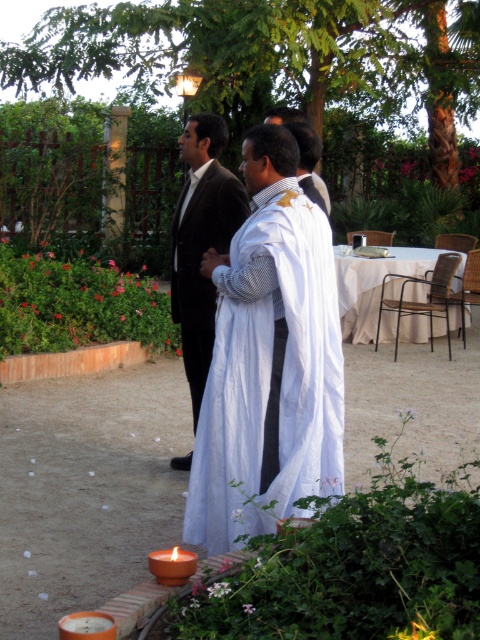
You are organizing a small evening gathering in this garden setting. You have a white cotton robe at center and a matte brown candle at lower left. Which object would require more space to store when packing up after the event?

The white cotton robe at center is bigger than the matte brown candle at lower left, so it would require more space to store when packing up after the event.

You are attending an evening ceremony and notice the white cotton robe at center and the matte brown candle at lower left. Which object is located more to the left side of the scene?

The white cotton robe at center is positioned on the left side of the matte brown candle at lower left, so it is more to the left.